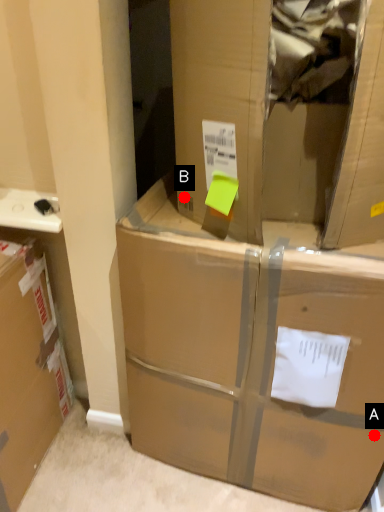
Question: Two points are circled on the image, labeled by A and B beside each circle. Which of the following is the farthest from the observer?

Choices:
 (A) A is further
 (B) B is further

Answer: (A)